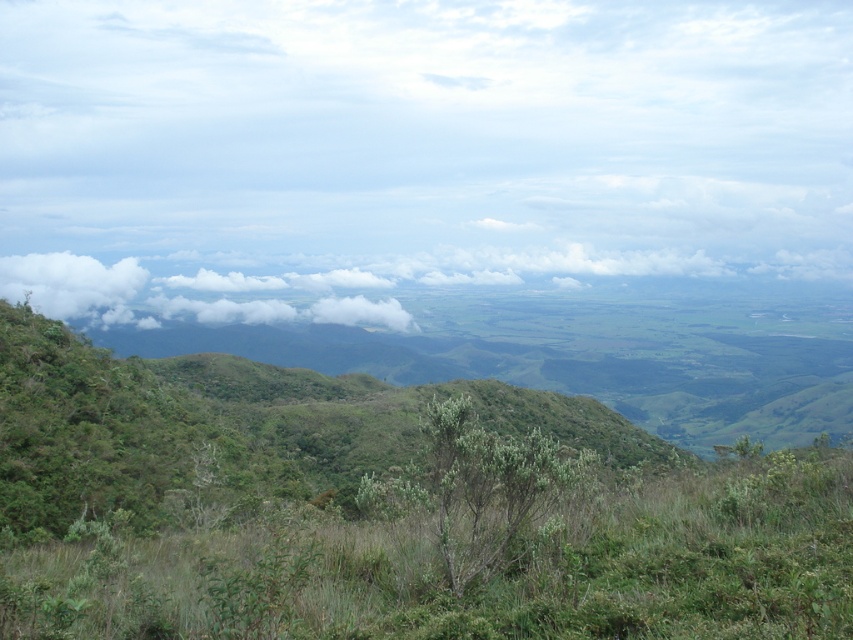
Question: Among these points, which one is farthest from the camera?

Choices:
 (A) (316, 314)
 (B) (714, 467)
 (C) (511, 474)

Answer: (A)

Question: Does white fluffy cloud at upper center have a smaller size compared to white fluffy cloud at upper left?

Choices:
 (A) no
 (B) yes

Answer: (A)

Question: Does white fluffy cloud at upper center appear over green leafy bush at center?

Choices:
 (A) yes
 (B) no

Answer: (A)

Question: Which point appears closest to the camera in this image?

Choices:
 (A) (773, 74)
 (B) (320, 308)
 (C) (437, 490)
 (D) (47, 301)

Answer: (C)

Question: Can you confirm if green leafy bush at center is positioned below white fluffy cloud at center?

Choices:
 (A) no
 (B) yes

Answer: (B)

Question: Which of the following is the farthest from the observer?

Choices:
 (A) (465, 547)
 (B) (683, 163)
 (C) (344, 317)

Answer: (B)